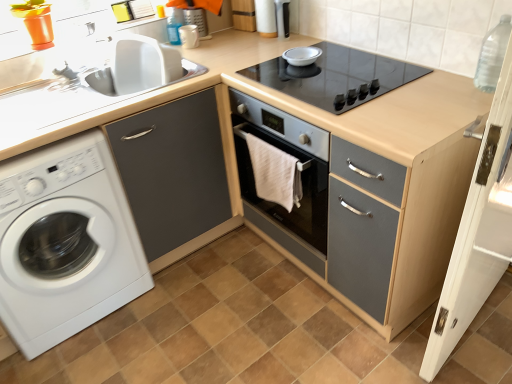
Find the location of a particular element. Image resolution: width=512 pixels, height=384 pixels. free space behind metallic silver toaster at upper center, the first appliance viewed from the right is located at coordinates pos(273,34).